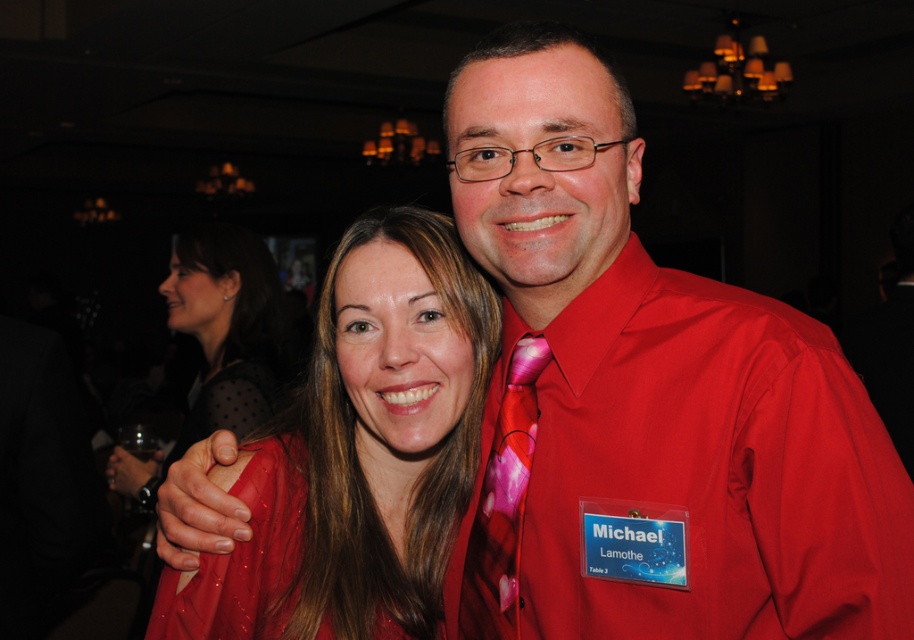
Is shiny red dress shirt at center positioned before pink floral fabric tie at upper center?

Yes.

Can you confirm if shiny red dress shirt at center is positioned to the right of pink floral fabric tie at upper center?

Correct, you'll find shiny red dress shirt at center to the right of pink floral fabric tie at upper center.

The height and width of the screenshot is (640, 914). What do you see at coordinates (713, 467) in the screenshot? I see `shiny red dress shirt at center` at bounding box center [713, 467].

You are a GUI agent. You are given a task and a screenshot of the screen. Output one action in this format:
    pyautogui.click(x=<x>, y=<y>)
    Task: Click on the shiny red dress shirt at center
    This screenshot has height=640, width=914.
    Given the screenshot: What is the action you would take?
    pyautogui.click(x=713, y=467)

Does point (840, 458) lie behind point (200, 320)?

No, (840, 458) is in front of (200, 320).

Can you confirm if shiny red dress shirt at center is shorter than satin black dress at center?

Yes, shiny red dress shirt at center is shorter than satin black dress at center.

Looking at this image, who is more forward, (721, 490) or (283, 301)?

Positioned in front is point (721, 490).

Where is `shiny red dress shirt at center`? This screenshot has height=640, width=914. shiny red dress shirt at center is located at coordinates (713, 467).

Does satin black dress at center appear under pink floral fabric tie at upper center?

Incorrect, satin black dress at center is not positioned below pink floral fabric tie at upper center.

This screenshot has width=914, height=640. Find the location of `satin black dress at center`. satin black dress at center is located at coordinates (218, 340).

Locate an element on the screen. This screenshot has width=914, height=640. satin black dress at center is located at coordinates (218, 340).

Find the location of a particular element. satin black dress at center is located at coordinates (218, 340).